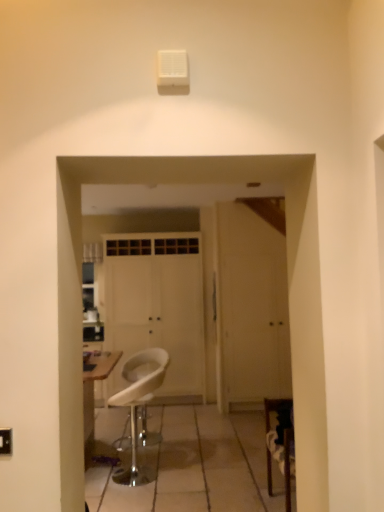
The image size is (384, 512). What are the coordinates of `free space in front of white plastic stool at center` in the screenshot? It's located at (143, 501).